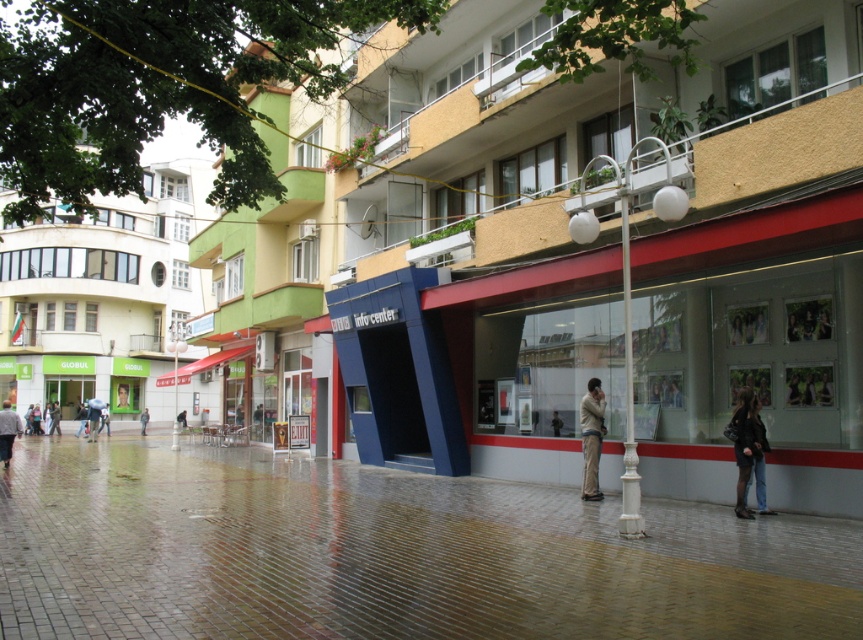
Question: Can you confirm if dark gray jacket at lower left is bigger than light blue fabric jacket at center?

Choices:
 (A) no
 (B) yes

Answer: (B)

Question: Which point is farther to the camera?

Choices:
 (A) (90, 428)
 (B) (147, 419)

Answer: (B)

Question: Which object is the farthest from the dark gray jacket at center?

Choices:
 (A) light brown fabric jacket at center
 (B) brick pavement at lower center

Answer: (A)

Question: Can you confirm if light brown fabric jacket at center is wider than light brown leather jacket at center?

Choices:
 (A) no
 (B) yes

Answer: (B)

Question: In this image, where is brick pavement at lower center located relative to light blue fabric jacket at center?

Choices:
 (A) below
 (B) above

Answer: (B)

Question: Which point is farther to the camera?

Choices:
 (A) dark gray jacket at center
 (B) dark brown leather jacket at lower right
 (C) dark gray jacket at lower left

Answer: (A)